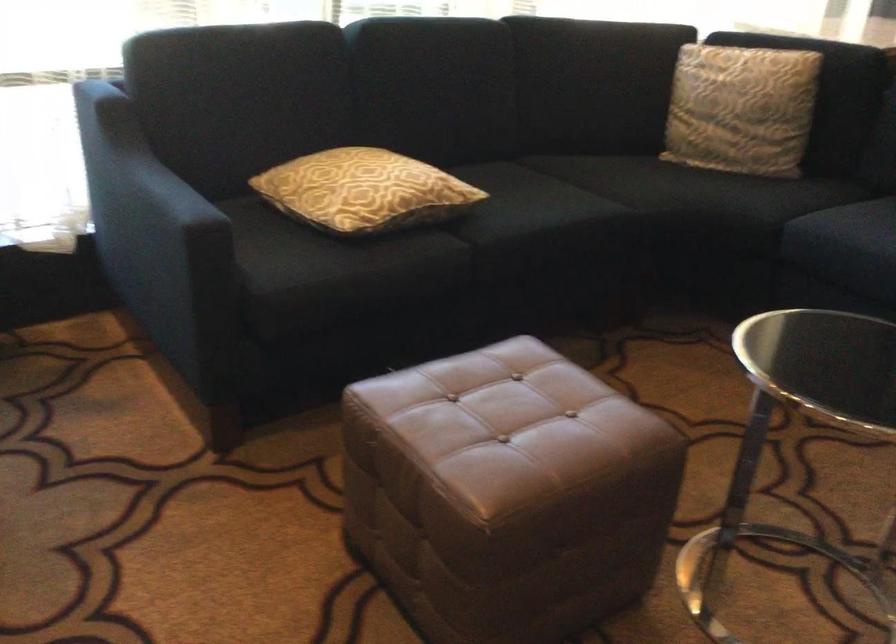
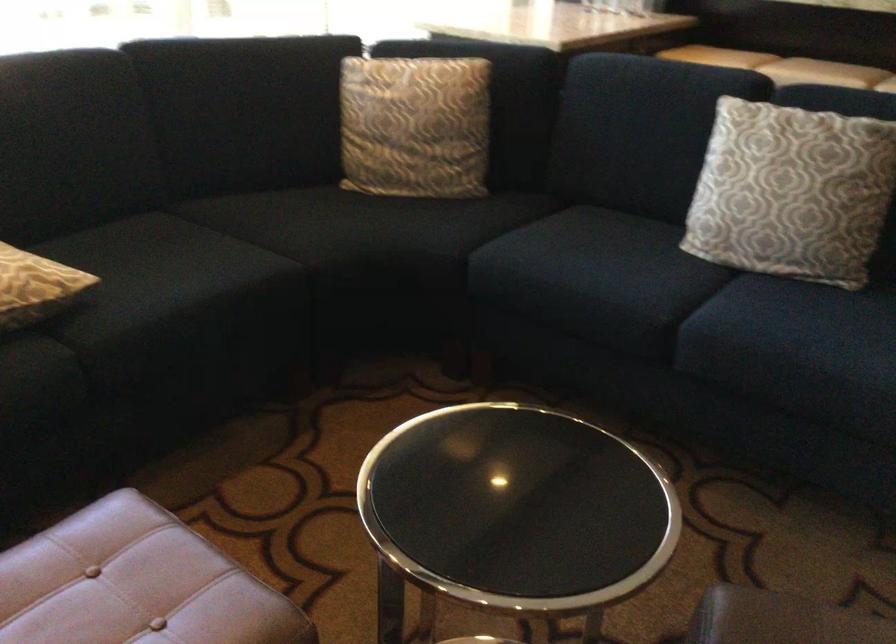
Which direction would the cameraman need to move to produce the second image?

The cameraman moved toward right, forward.